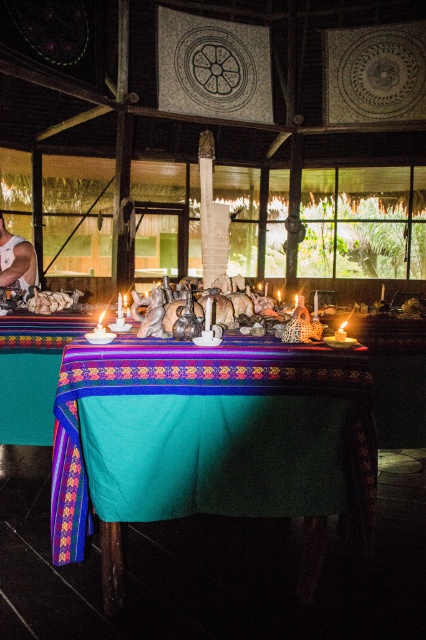
You are standing in the ceremonial space and want to place a 2.5 feet long ritual object on the teal fabric table at center. Can you reach the table from your current position without moving closer?

The teal fabric table at center is 5.83 feet away from you. Since the ritual object is 2.5 feet long, you can comfortably reach the table to place it without needing to move closer.